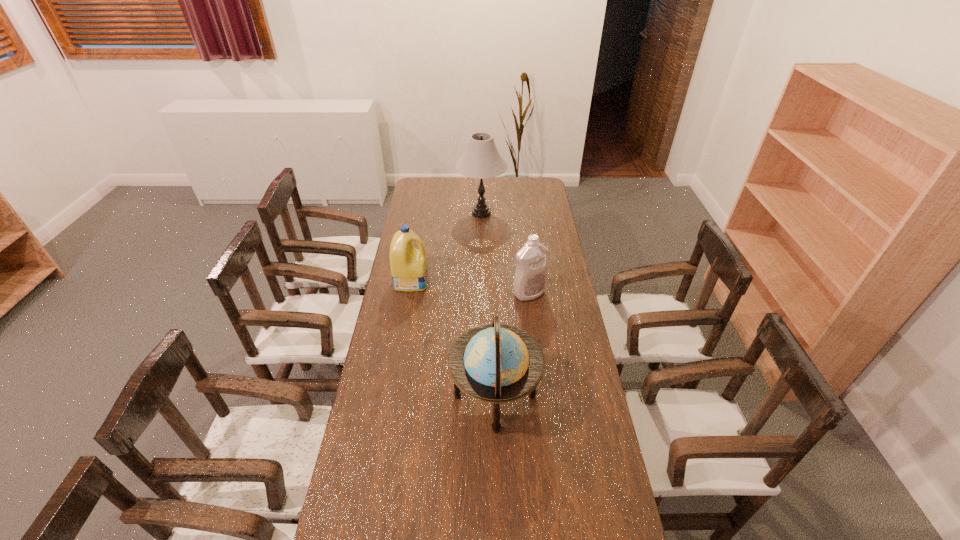
At what (x,y) coordinates should I click in order to perform the action: click on vacant space located 0.260m on the label of the left detergent. Please return your answer as a coordinate pair (x, y). Looking at the image, I should click on (488, 280).

Locate an element on the screen. object that is at the left edge is located at coordinates (409, 268).

This screenshot has width=960, height=540. What are the coordinates of `object situated at the right edge` in the screenshot? It's located at (530, 279).

Where is `free point at the far edge`? free point at the far edge is located at coordinates (467, 182).

Identify the location of free space at the left edge of the desktop. (405, 397).

Identify the location of vacant area at the right edge. (560, 242).

In the image, there is a desktop. Where is `vacant region at the far right corner`? This screenshot has width=960, height=540. vacant region at the far right corner is located at coordinates (543, 183).

Locate an element on the screen. This screenshot has height=540, width=960. vacant space in between the tallest object and the globe is located at coordinates (488, 305).

Identify the location of empty space that is in between the farthest object and the leftmost object. (446, 247).

Where is `unoccupied position between the leftmost object and the nearest object`? Image resolution: width=960 pixels, height=540 pixels. unoccupied position between the leftmost object and the nearest object is located at coordinates (453, 339).